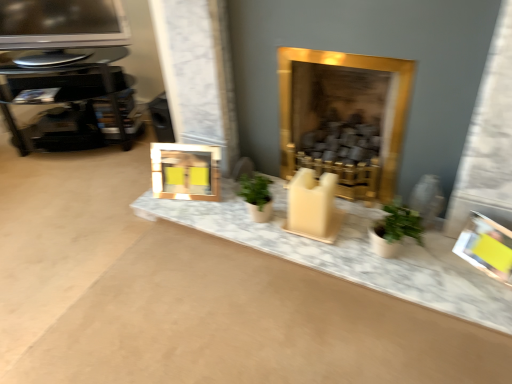
In order to click on vacant space in front of yellow paper picture frame at right, arranged as the 2th picture frame when viewed from the top in this screenshot , I will do `click(488, 299)`.